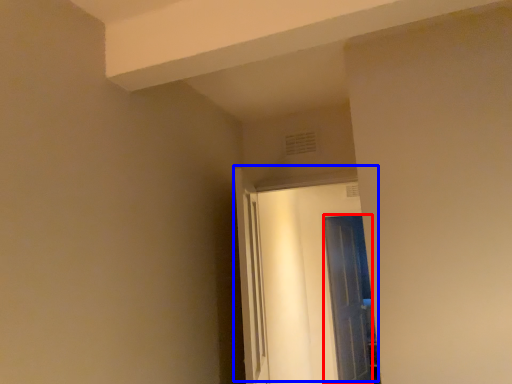
Question: Which point is further to the camera, door (highlighted by a red box) or door (highlighted by a blue box)?

Choices:
 (A) door
 (B) door

Answer: (A)